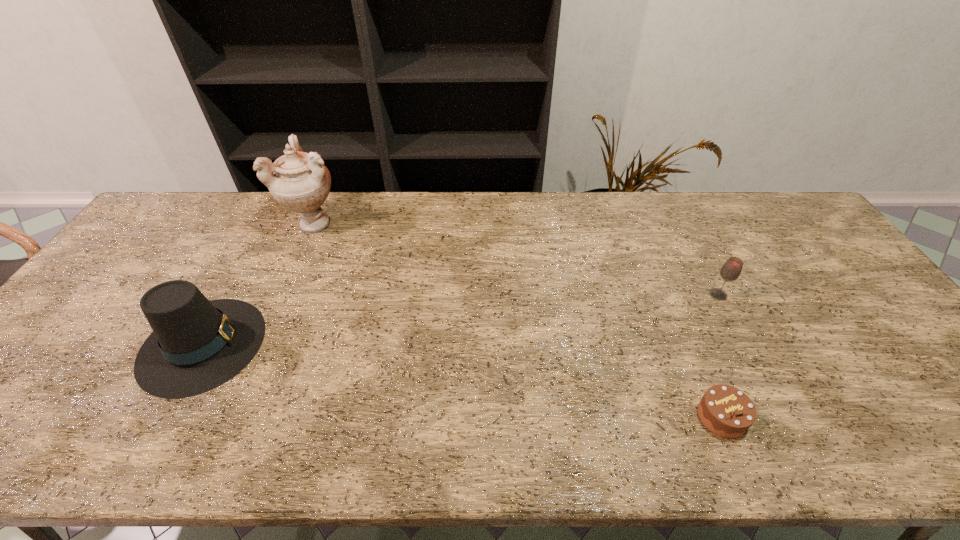
Locate an element on the screen. The image size is (960, 540). free point located on the left of the chocolate cake is located at coordinates (648, 417).

The image size is (960, 540). I want to click on object at the far edge, so click(x=299, y=181).

Locate an element on the screen. object that is at the near edge is located at coordinates click(726, 411).

In order to click on free space at the far edge of the desktop in this screenshot , I will do `click(399, 192)`.

Where is `free space at the near edge`? This screenshot has width=960, height=540. free space at the near edge is located at coordinates (287, 443).

Find the location of `free space at the left edge of the desktop`. free space at the left edge of the desktop is located at coordinates (20, 375).

In the image, there is a desktop. Find the location of `vacant space at the right edge`. vacant space at the right edge is located at coordinates (860, 327).

Locate an element on the screen. The image size is (960, 540). vacant point at the far left corner is located at coordinates click(x=213, y=199).

Image resolution: width=960 pixels, height=540 pixels. Identify the location of vacant region between the tallest object and the chocolate cake. (519, 320).

Find the location of a particular element. The image size is (960, 540). vacant space in between the shortest object and the hat is located at coordinates (462, 380).